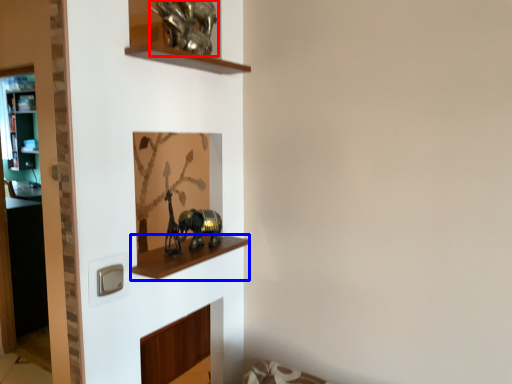
Question: Among these objects, which one is farthest to the camera, animal (highlighted by a red box) or cabinet (highlighted by a blue box)?

Choices:
 (A) animal
 (B) cabinet

Answer: (A)